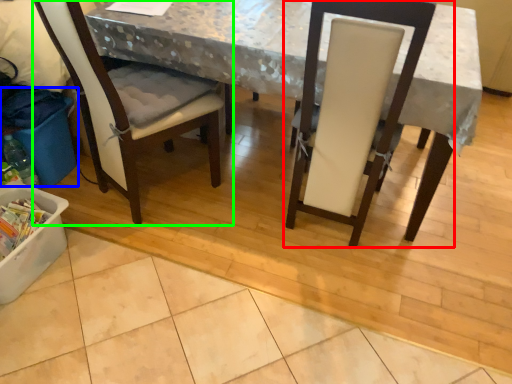
Question: Which object is positioned closest to chair (highlighted by a red box)? Select from recycling bin (highlighted by a blue box) and chair (highlighted by a green box).

Choices:
 (A) recycling bin
 (B) chair

Answer: (B)